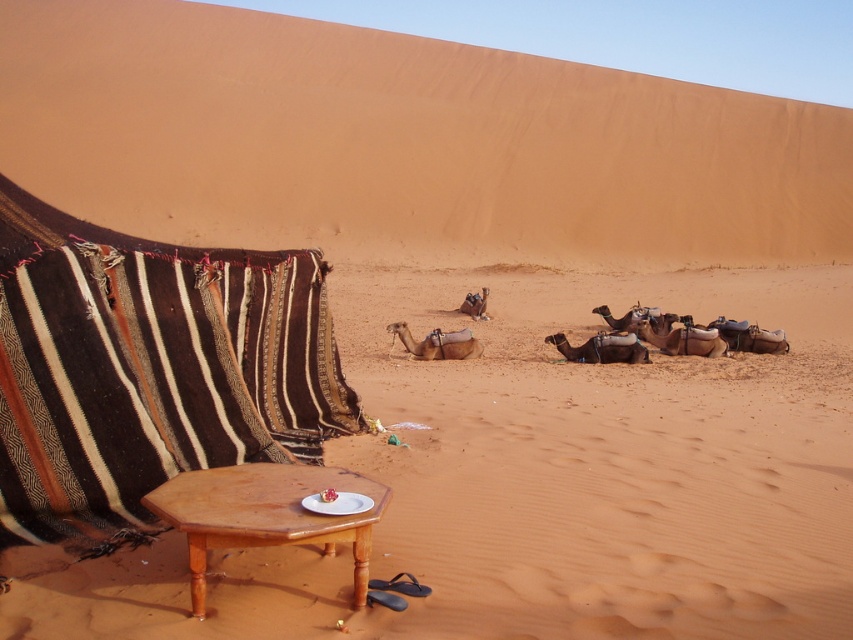
Can you confirm if smooth sand dune at upper left is wider than brown striped fabric at left?

Indeed, smooth sand dune at upper left has a greater width compared to brown striped fabric at left.

Who is more distant from viewer, [403,56] or [248,384]?

The point [403,56] is behind.

Where is `smooth sand dune at upper left`? The height and width of the screenshot is (640, 853). smooth sand dune at upper left is located at coordinates pyautogui.click(x=403, y=144).

Is sandy yellow sand at center thinner than brown wooden table at lower center?

No.

Which is behind, point (729, 435) or point (268, 504)?

Positioned behind is point (729, 435).

Identify the location of sandy yellow sand at center. (548, 477).

Which of these two, sandy yellow sand at center or brown striped fabric at left, stands shorter?

Standing shorter between the two is sandy yellow sand at center.

Who is taller, sandy yellow sand at center or brown striped fabric at left?

Standing taller between the two is brown striped fabric at left.

Who is more distant from viewer, (778, 396) or (15, 314)?

The point (778, 396) is more distant.

Find the location of a particular element. This screenshot has height=640, width=853. sandy yellow sand at center is located at coordinates [548, 477].